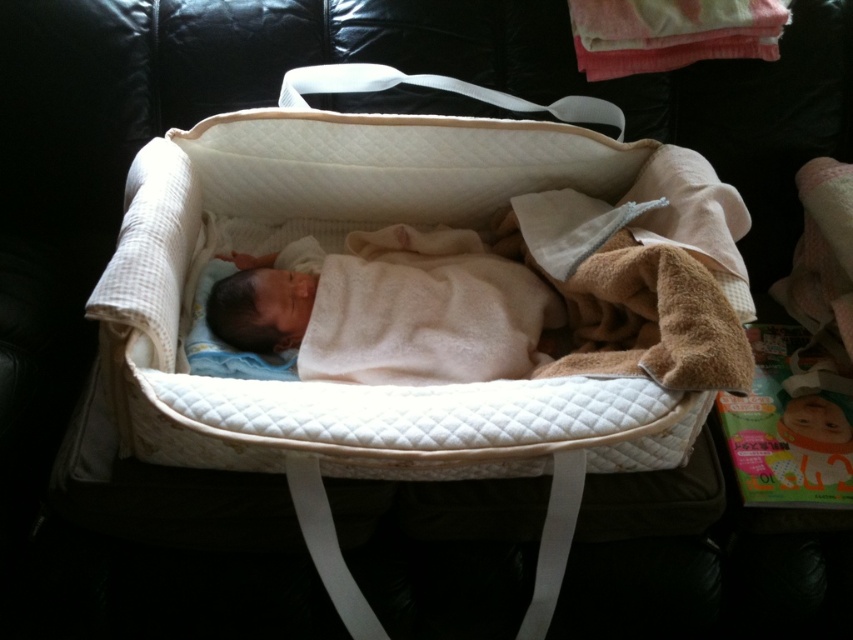
Is white quilted mattress at center below white soft blanket at center?

No, white quilted mattress at center is not below white soft blanket at center.

Is white quilted mattress at center thinner than white soft blanket at center?

No.

The image size is (853, 640). Describe the element at coordinates (339, 248) in the screenshot. I see `white quilted mattress at center` at that location.

The height and width of the screenshot is (640, 853). Identify the location of white quilted mattress at center. (339, 248).